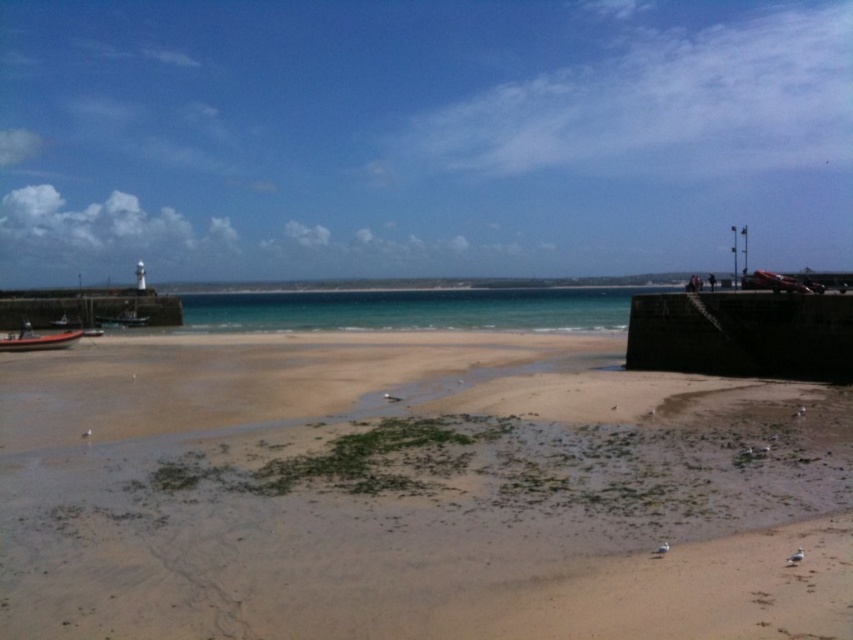
Is point (204, 454) closer to camera compared to point (55, 342)?

Yes, point (204, 454) is closer to viewer.

Is the position of brown sandy beach at lower center more distant than that of orange fiberglass boat at lower left?

No, it is not.

At what (x,y) coordinates should I click in order to perform the action: click on brown sandy beach at lower center. Please return your answer as a coordinate pair (x, y). Looking at the image, I should click on (415, 492).

Locate an element on the screen. brown sandy beach at lower center is located at coordinates (415, 492).